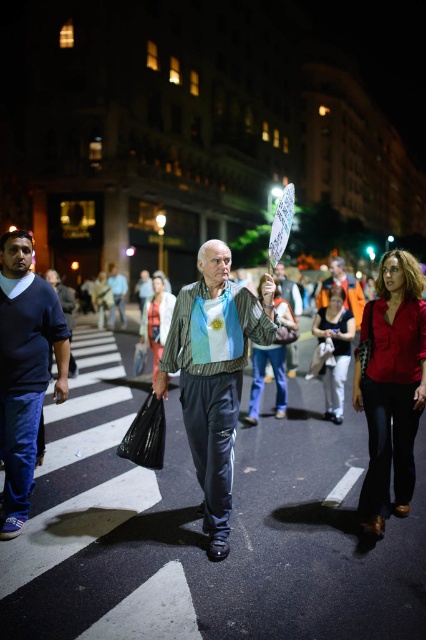
Question: Which of the following is the farthest from the observer?

Choices:
 (A) (45, 330)
 (B) (291, 348)
 (C) (183, 397)

Answer: (B)

Question: Which object appears closest to the camera in this image?

Choices:
 (A) white paper sign at center
 (B) orange fabric shirt at center
 (C) dark blue sweater at left
 (D) striped fabric shirt at center

Answer: (D)

Question: Does striped fabric shirt at center appear under dark blue sweater at left?

Choices:
 (A) no
 (B) yes

Answer: (B)

Question: Is dark blue sweater at left behind orange fabric shirt at center?

Choices:
 (A) yes
 (B) no

Answer: (B)

Question: Which point is closer to the camera?

Choices:
 (A) (23, 284)
 (B) (282, 289)
 (C) (347, 300)

Answer: (A)

Question: Is dark blue sweater at left smaller than white paper sign at center?

Choices:
 (A) no
 (B) yes

Answer: (B)